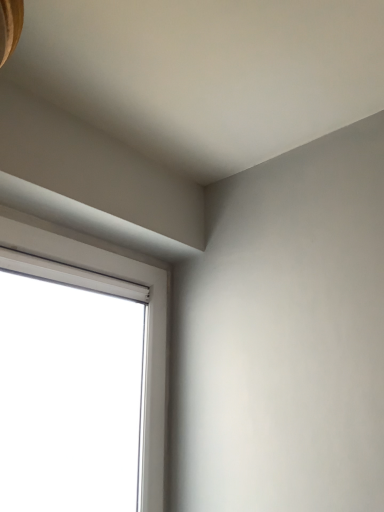
Image resolution: width=384 pixels, height=512 pixels. What do you see at coordinates (149, 322) in the screenshot? I see `white plastic window at upper left` at bounding box center [149, 322].

You are a GUI agent. You are given a task and a screenshot of the screen. Output one action in this format:
    pyautogui.click(x=<x>, y=<y>)
    Task: Click on the white plastic window at upper left
    This screenshot has height=512, width=384.
    Given the screenshot: What is the action you would take?
    pyautogui.click(x=149, y=322)

Identify the location of white plastic window at upper left. (149, 322).